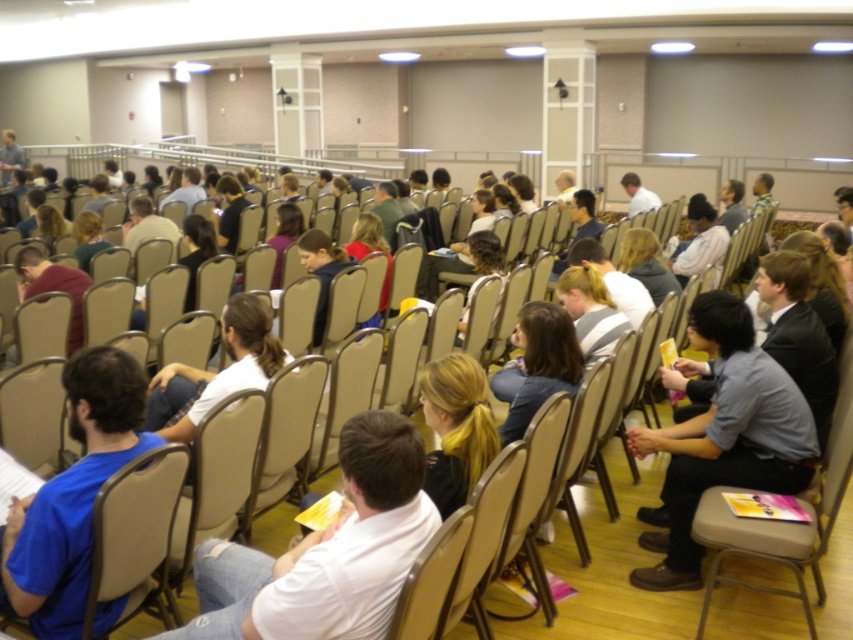
Question: Which point is farther to the camera?

Choices:
 (A) (227, 525)
 (B) (86, 276)
 (C) (42, 499)

Answer: (B)

Question: Which of the following is the closest to the observer?

Choices:
 (A) (421, 385)
 (B) (90, 284)

Answer: (A)

Question: Does beige plastic chair at lower left have a larger size compared to blonde hair ponytail at center?

Choices:
 (A) yes
 (B) no

Answer: (A)

Question: Which object is positioned closest to the white cotton shirt at center?

Choices:
 (A) dark blue shirt at center
 (B) white matte shirt at center
 (C) beige fabric chair at center
 (D) beige plastic chair at lower left

Answer: (C)

Question: Is blonde hair ponytail at center to the right of matte red shirt at center from the viewer's perspective?

Choices:
 (A) yes
 (B) no

Answer: (A)

Question: Can you confirm if light gray fabric shirt at center right is positioned to the left of blonde hair ponytail at center?

Choices:
 (A) no
 (B) yes

Answer: (A)